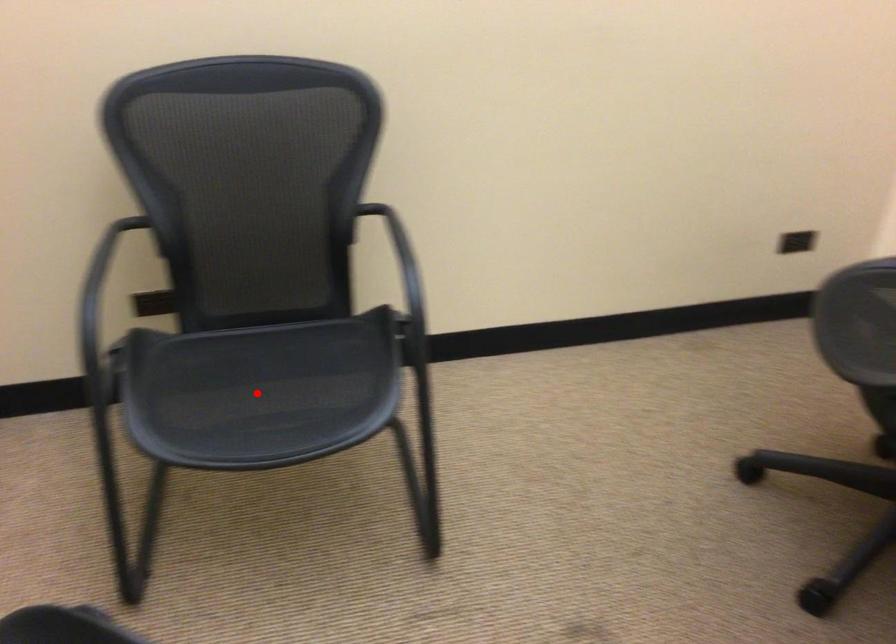
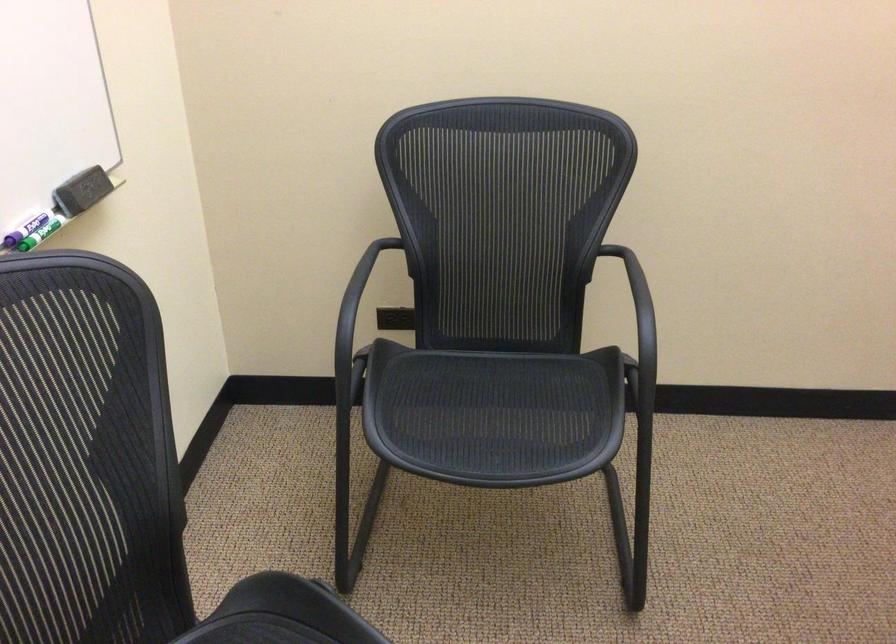
Find the pixel in the second image that matches the highlighted location in the first image.

(478, 413)